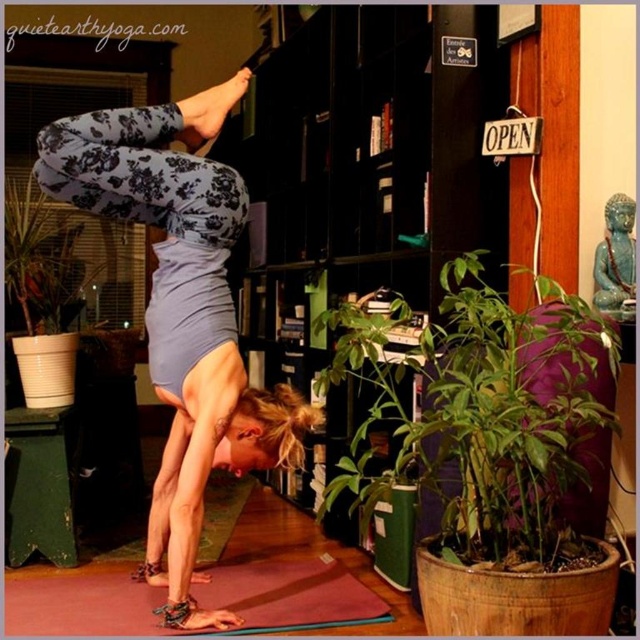
Does floral leggings at center have a smaller size compared to rubber yoga mat at lower center?

Incorrect, floral leggings at center is not smaller in size than rubber yoga mat at lower center.

From the picture: Can you confirm if floral leggings at center is wider than rubber yoga mat at lower center?

Incorrect, floral leggings at center's width does not surpass rubber yoga mat at lower center's.

Measure the distance between point (225, 445) and camera.

They are 2.44 meters apart.

Where is `floral leggings at center`? The height and width of the screenshot is (640, 640). floral leggings at center is located at coordinates (180, 310).

Is point (365, 188) more distant than point (234, 81)?

Yes, point (365, 188) is farther from viewer.

This screenshot has width=640, height=640. In order to click on black wood bookshelf at center in this screenshot , I will do `click(371, 156)`.

Between floral leggings at center and green leafy plant at lower right, which one appears on the left side from the viewer's perspective?

Positioned to the left is floral leggings at center.

Does floral leggings at center appear on the right side of green leafy plant at lower right?

No, floral leggings at center is not to the right of green leafy plant at lower right.

Locate an element on the screen. floral leggings at center is located at coordinates (180, 310).